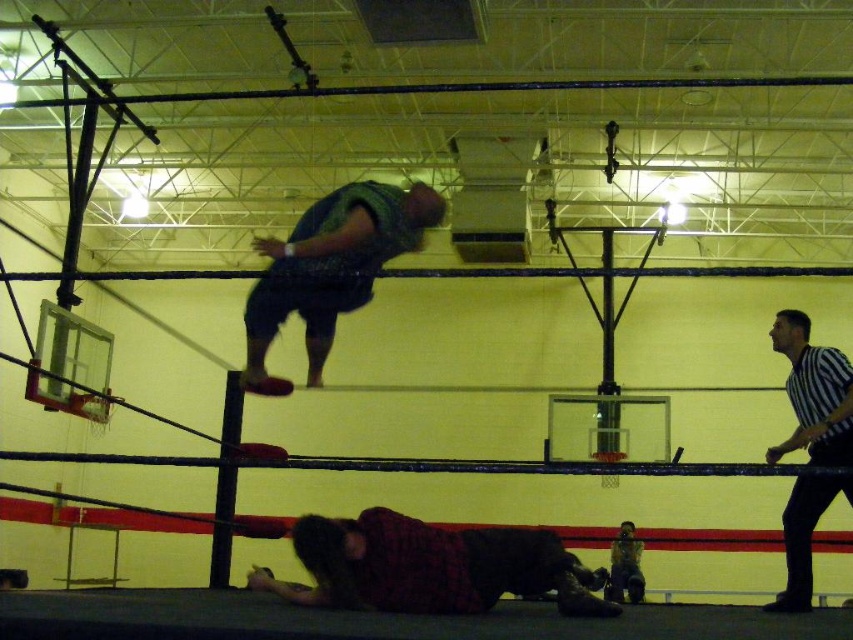
Find the location of `plaid shirt at lower center`. plaid shirt at lower center is located at coordinates (428, 566).

Is plaid shirt at lower center shorter than black striped shirt at right?

Yes, plaid shirt at lower center is shorter than black striped shirt at right.

Who is more forward, (590, 596) or (801, 380)?

Point (590, 596) is in front.

The height and width of the screenshot is (640, 853). What are the coordinates of `plaid shirt at lower center` in the screenshot? It's located at (428, 566).

Between point (289, 259) and point (851, 412), which one is positioned in front?

Positioned in front is point (289, 259).

You are a GUI agent. You are given a task and a screenshot of the screen. Output one action in this format:
    pyautogui.click(x=<x>, y=<y>)
    Task: Click on the green textured shirt at upper center
    
    Given the screenshot: What is the action you would take?
    pyautogui.click(x=332, y=262)

Find the location of `green textured shirt at upper center`. green textured shirt at upper center is located at coordinates (332, 262).

Consider the image. Can you confirm if plaid shirt at lower center is shorter than green textured shirt at upper center?

Yes, plaid shirt at lower center is shorter than green textured shirt at upper center.

Can you confirm if plaid shirt at lower center is wider than green textured shirt at upper center?

Yes, plaid shirt at lower center is wider than green textured shirt at upper center.

Image resolution: width=853 pixels, height=640 pixels. Identify the location of plaid shirt at lower center. (428, 566).

Identify the location of plaid shirt at lower center. This screenshot has width=853, height=640. (428, 566).